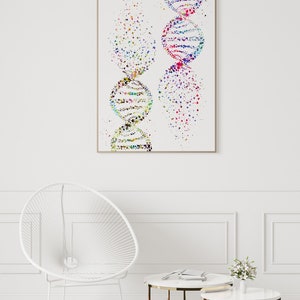
Find the location of `wall`. wall is located at coordinates [269, 110].